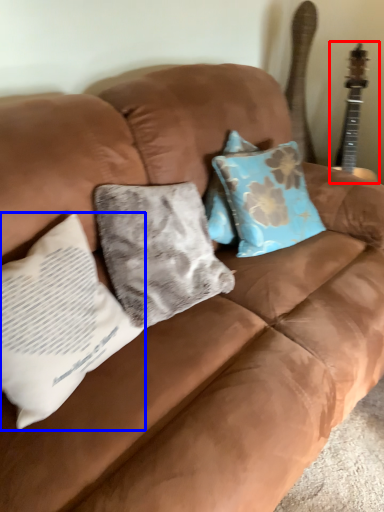
Question: Among these objects, which one is farthest to the camera, guitar (highlighted by a red box) or pillow (highlighted by a blue box)?

Choices:
 (A) guitar
 (B) pillow

Answer: (A)